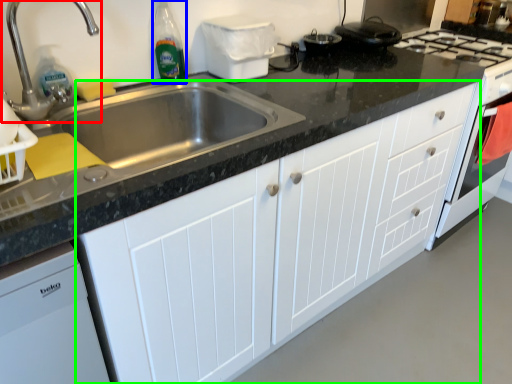
Question: Which object is positioned farthest from tap (highlighted by a red box)? Select from bottle (highlighted by a blue box) and cabinetry (highlighted by a green box).

Choices:
 (A) bottle
 (B) cabinetry

Answer: (B)